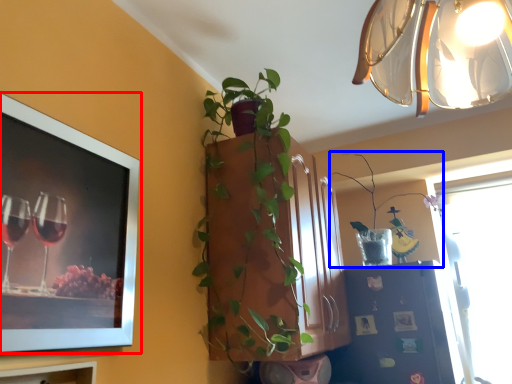
Question: Which point is further to the camera, picture frame (highlighted by a red box) or houseplant (highlighted by a blue box)?

Choices:
 (A) picture frame
 (B) houseplant

Answer: (B)